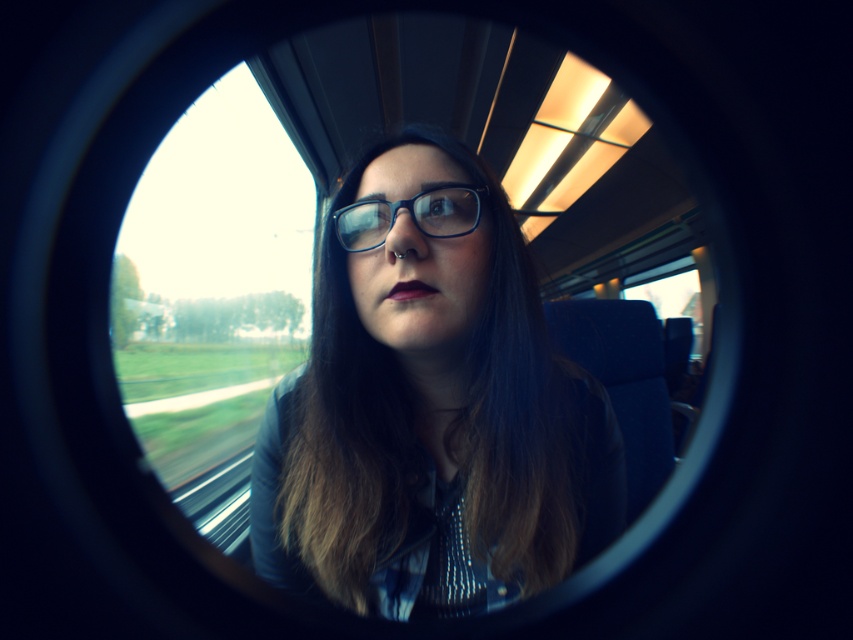
Which is above, matte blue glasses at center or transparent glass window at center?

matte blue glasses at center is higher up.

Consider the image. Which is more to the left, matte blue glasses at center or transparent glass window at center?

From the viewer's perspective, transparent glass window at center appears more on the left side.

Which is in front, point (442, 573) or point (286, 339)?

Point (442, 573) is in front.

Identify the location of matte blue glasses at center. The height and width of the screenshot is (640, 853). (430, 406).

How much distance is there between matte blue glasses at center and blue plastic glasses at center?

matte blue glasses at center and blue plastic glasses at center are 14.24 centimeters apart from each other.

Between matte blue glasses at center and blue plastic glasses at center, which one has less height?

blue plastic glasses at center

The height and width of the screenshot is (640, 853). What do you see at coordinates (430, 406) in the screenshot?
I see `matte blue glasses at center` at bounding box center [430, 406].

What are the coordinates of `matte blue glasses at center` in the screenshot? It's located at (430, 406).

Is point (282, 301) positioned before point (416, 220)?

That is False.

Which is in front, point (262, 225) or point (444, 189)?

Point (444, 189) is in front.

Measure the distance between transparent glass window at center and camera.

transparent glass window at center is 10.36 feet away from camera.

What are the coordinates of `transparent glass window at center` in the screenshot? It's located at (212, 296).